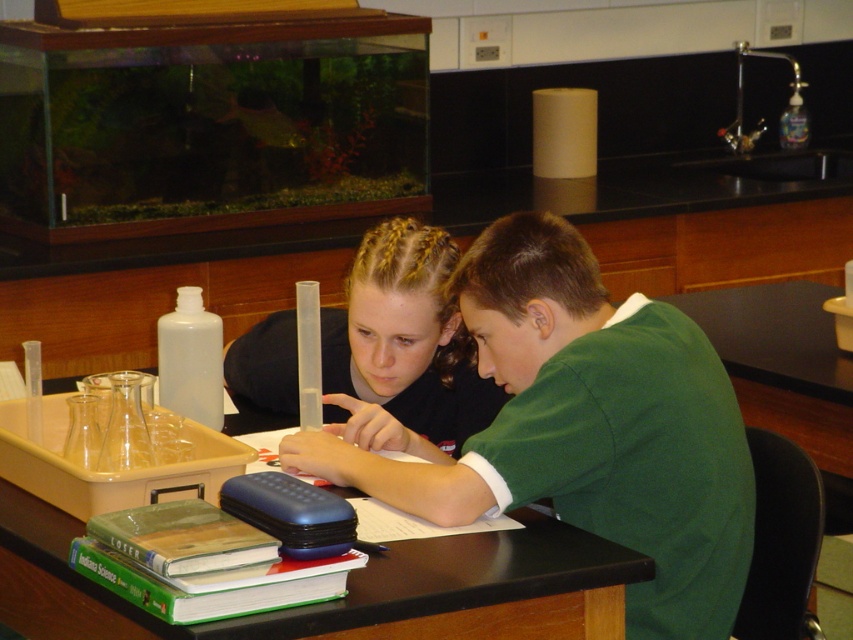
You are a student trying to place a textbook on the desk. Considering the height difference between the black matte table at center and the smooth black shirt at center, will the textbook fit on the table without touching the shirt?

The black matte table at center has a lesser height compared to the smooth black shirt at center, so the textbook may not fit on the table without touching the shirt because the shirt is taller than the table.

You are a student trying to locate two points marked on the desk in the classroom. The first point is at coordinate point (86, 595) and the second is at point (436, 410). Which point is closer to you?

Point (86, 595) is closer to you than point (436, 410) because the first point is closer to the camera.

You are a student trying to determine which person is standing closer to the front of the classroom. You see the green matte shirt at center and the smooth black shirt at center. Based on their positions relative to you, which one is nearer?

The green matte shirt at center is closer to the viewer than the smooth black shirt at center, so the person wearing the green matte shirt at center is nearer.